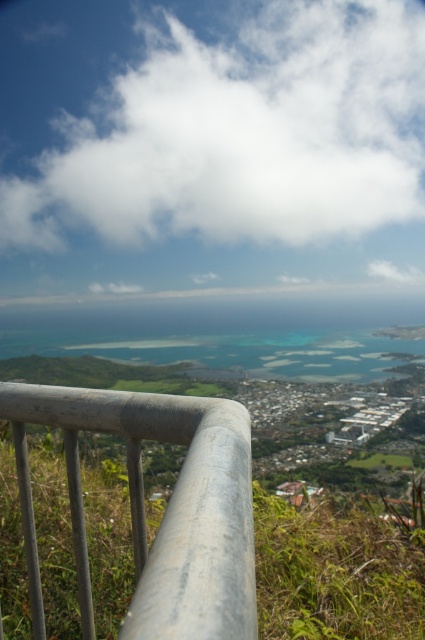
You are standing on the viewing platform and want to take a photo of the silver metallic rail at center and the white fluffy cloud at upper center. Which object will appear closer to the camera in your photo?

The white fluffy cloud at upper center will appear closer to the camera in the photo because the silver metallic rail at center is behind it.

You are standing on the viewing platform and looking out at the coastal view. Which object, the white fluffy cloud at upper center or the silver metallic rail at center, is higher in the sky?

The white fluffy cloud at upper center is higher in the sky than the silver metallic rail at center because it is positioned above it.

You are a drone operator who needs to fly a drone from the silver metallic rail at center to the white fluffy cloud at upper center. Given that the drone has a maximum range of 800 meters, will it be able to reach the cloud without needing to recharge?

The distance between the silver metallic rail at center and the white fluffy cloud at upper center is 887.64 meters, which exceeds the drone operator maximum range of 800 meters. Therefore, the drone will not be able to reach the white fluffy cloud at upper center without recharging.